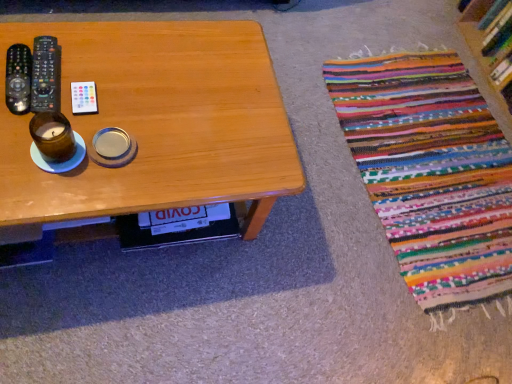
Where is `free space behind brown glass candle at left`? The image size is (512, 384). free space behind brown glass candle at left is located at coordinates (111, 91).